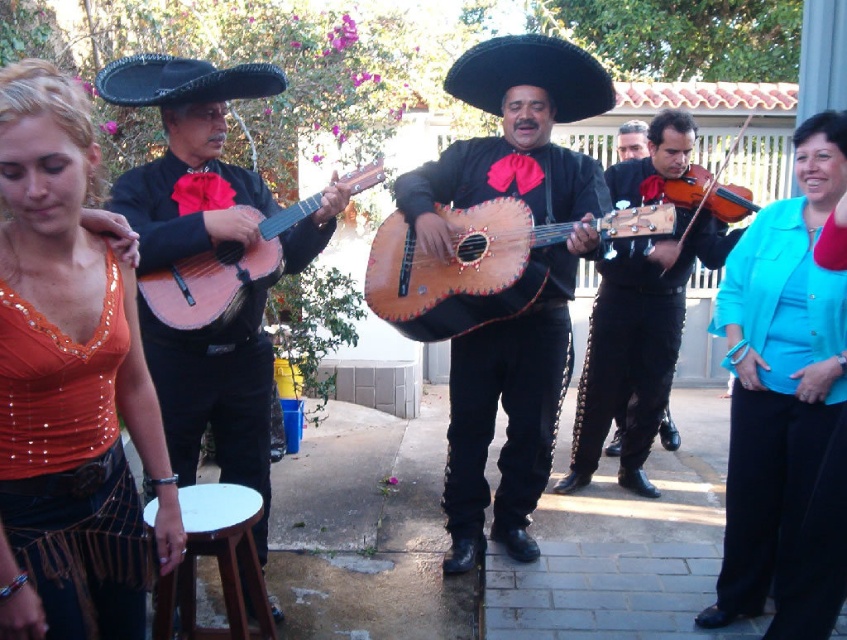
Does black felt sombrero at center have a smaller size compared to shiny brown guitar at right?

No, black felt sombrero at center is not smaller than shiny brown guitar at right.

Who is positioned more to the right, black felt sombrero at center or shiny brown guitar at right?

Positioned to the right is shiny brown guitar at right.

Measure the distance between black felt sombrero at center and camera.

The distance of black felt sombrero at center from camera is 3.37 meters.

Where is `black felt sombrero at center`? This screenshot has height=640, width=847. black felt sombrero at center is located at coordinates (530, 76).

Based on the photo, between leather-like brown guitar at center and wooden acoustic guitar at center-left, which one appears on the left side from the viewer's perspective?

From the viewer's perspective, wooden acoustic guitar at center-left appears more on the left side.

Is leather-like brown guitar at center thinner than wooden acoustic guitar at center-left?

In fact, leather-like brown guitar at center might be wider than wooden acoustic guitar at center-left.

Who is more forward, [511,273] or [169,289]?

Positioned in front is point [169,289].

Image resolution: width=847 pixels, height=640 pixels. I want to click on leather-like brown guitar at center, so click(458, 269).

Between orange sequined blouse at left and white wood stool at lower left, which one is positioned lower?

white wood stool at lower left

Is point (76, 593) positioned in front of point (172, 608)?

Yes, point (76, 593) is closer to viewer.

What are the coordinates of `orange sequined blouse at left` in the screenshot? It's located at (68, 376).